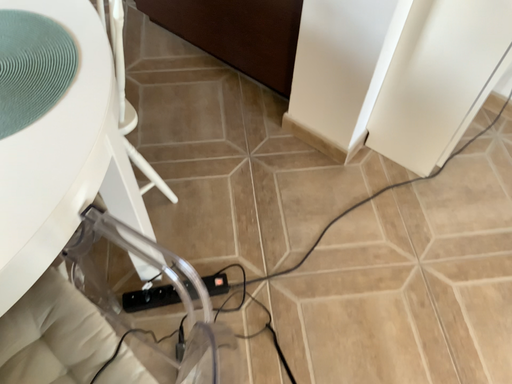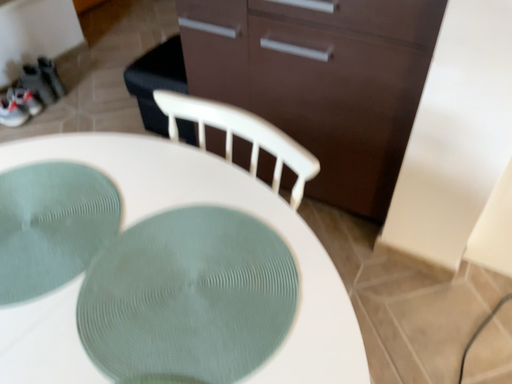
Question: How did the camera likely rotate when shooting the video?

Choices:
 (A) rotated upward
 (B) rotated downward

Answer: (A)